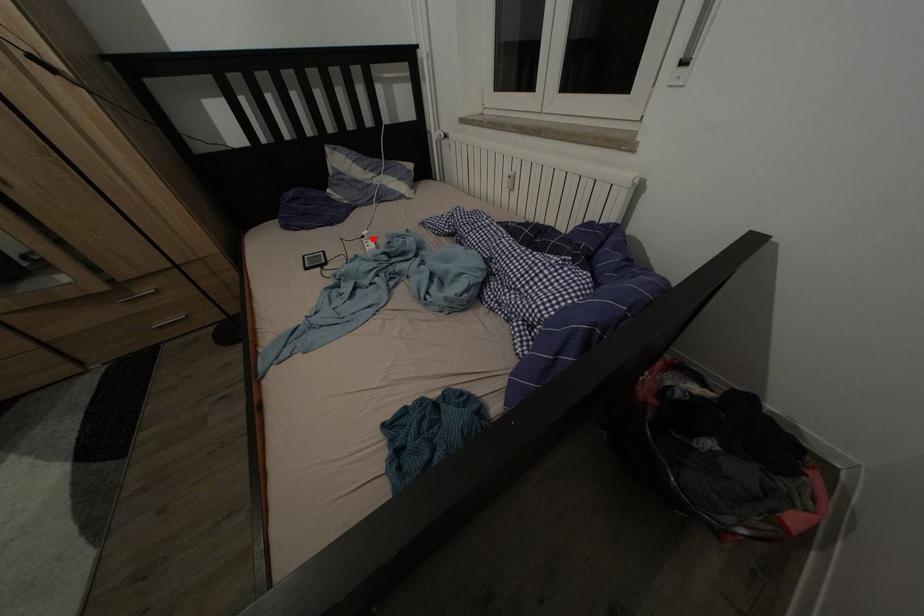
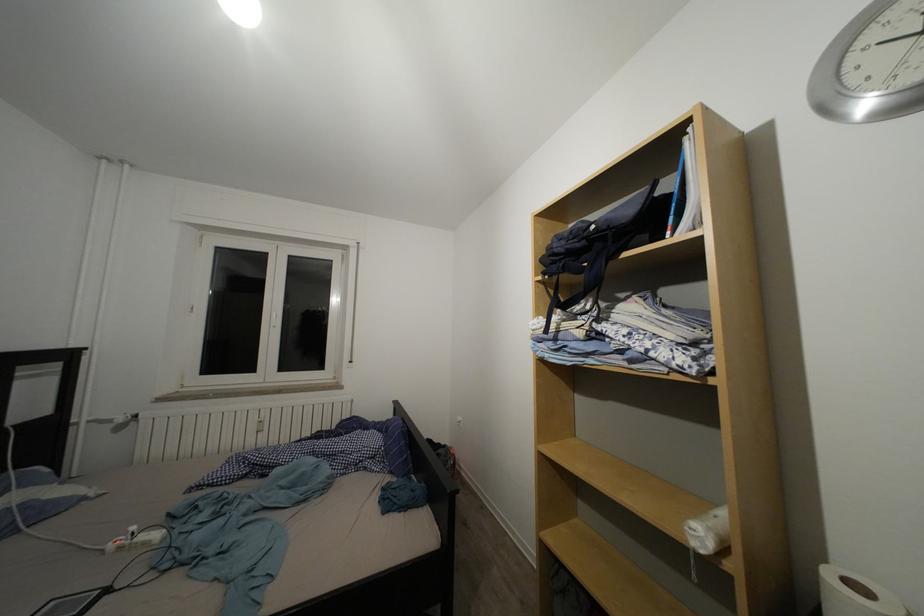
The point at the highlighted location is marked in the first image. Where is the corresponding point in the second image?

(140, 533)